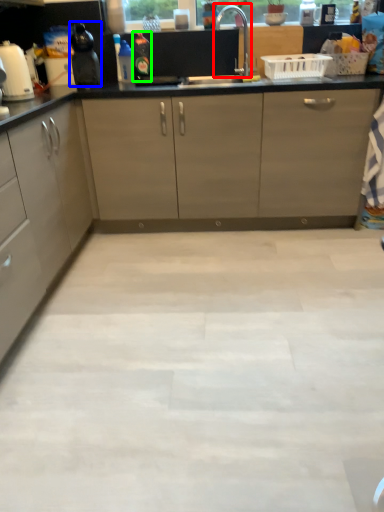
Question: Considering the real-world distances, which object is closest to faucet (highlighted by a red box)? kitchen appliance (highlighted by a blue box) or bottle (highlighted by a green box).

Choices:
 (A) kitchen appliance
 (B) bottle

Answer: (B)